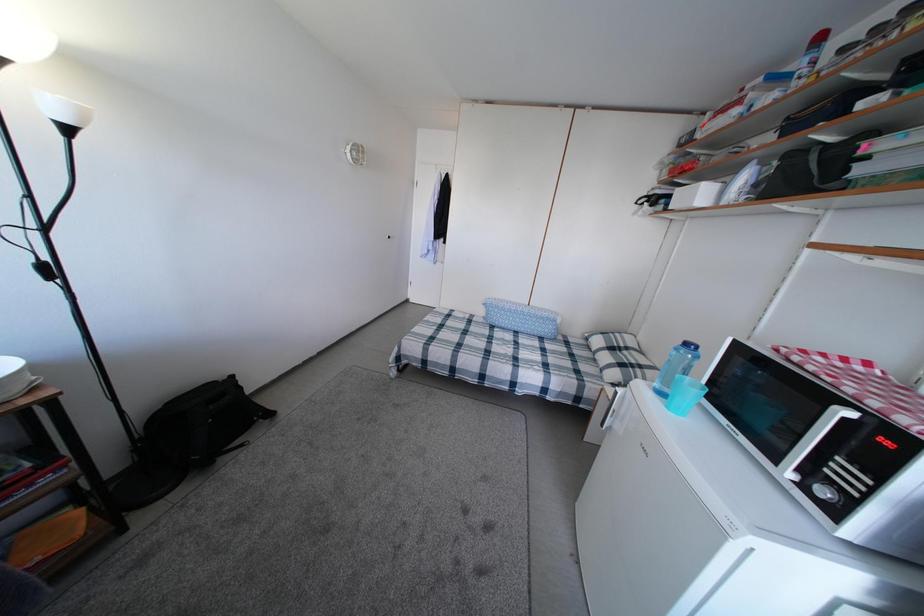
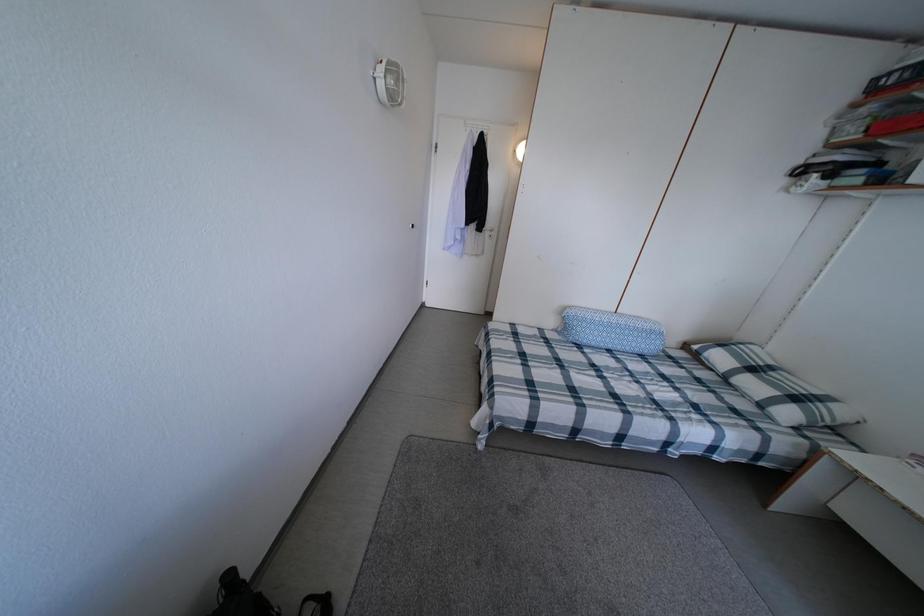
What movement of the cameraman would produce the second image?

The cameraman moved toward left, forward.